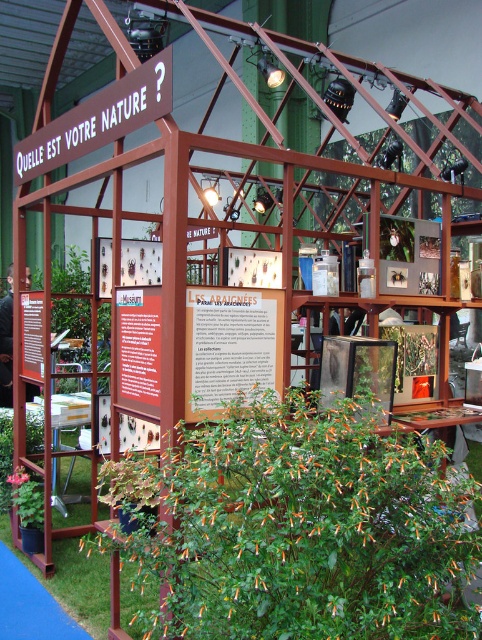
Can you confirm if green leafy plant at lower center is positioned below wooden sign at center?

Indeed, green leafy plant at lower center is positioned under wooden sign at center.

Based on the photo, is green leafy plant at lower center wider than wooden sign at center?

Indeed, green leafy plant at lower center has a greater width compared to wooden sign at center.

Image resolution: width=482 pixels, height=640 pixels. I want to click on green leafy plant at lower center, so click(295, 528).

I want to click on green leafy plant at lower center, so click(295, 528).

Which is more to the left, wooden sign at center or green leafy plant at lower left?

Positioned to the left is green leafy plant at lower left.

This screenshot has width=482, height=640. What do you see at coordinates (230, 346) in the screenshot? I see `wooden sign at center` at bounding box center [230, 346].

The width and height of the screenshot is (482, 640). In order to click on wooden sign at center in this screenshot , I will do `click(230, 346)`.

Where is `green leafy plant at lower center`? green leafy plant at lower center is located at coordinates (295, 528).

Is green leafy plant at lower center taller than green leafy plant at lower left?

Yes.

Identify the location of green leafy plant at lower center. This screenshot has width=482, height=640. (295, 528).